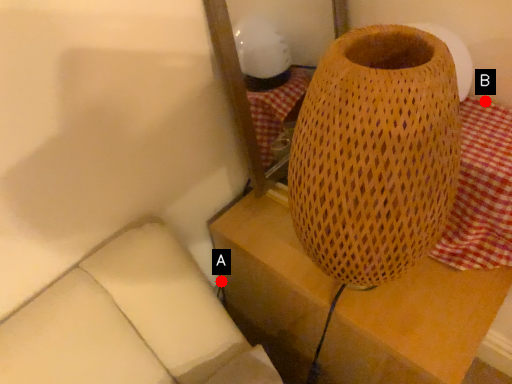
Question: Two points are circled on the image, labeled by A and B beside each circle. Which point appears farthest from the camera in this image?

Choices:
 (A) A is further
 (B) B is further

Answer: (A)